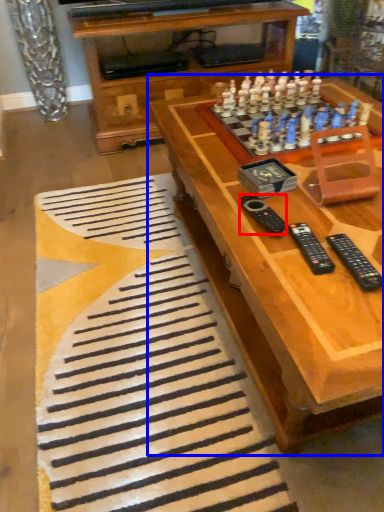
Question: Among these objects, which one is nearest to the camera, remote (highlighted by a red box) or table (highlighted by a blue box)?

Choices:
 (A) remote
 (B) table

Answer: (B)